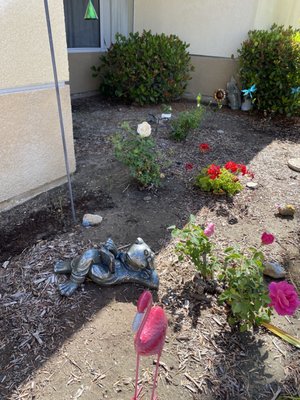
This screenshot has width=300, height=400. Identify the location of window. (94, 36).